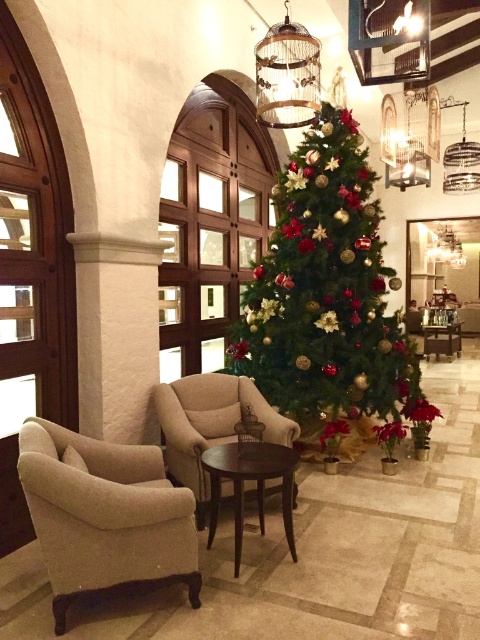
Question: Among these objects, which one is farthest from the camera?

Choices:
 (A) beige fabric armchair at left
 (B) shiny gold christmas tree at center
 (C) beige fabric armchair at center

Answer: (B)

Question: Which point is closer to the camera?

Choices:
 (A) shiny gold christmas tree at center
 (B) beige fabric armchair at center
 (C) beige fabric armchair at left

Answer: (C)

Question: Can you confirm if shiny gold christmas tree at center is smaller than beige fabric armchair at center?

Choices:
 (A) no
 (B) yes

Answer: (A)

Question: From the image, what is the correct spatial relationship of shiny gold christmas tree at center in relation to beige fabric armchair at center?

Choices:
 (A) left
 (B) right

Answer: (B)

Question: Does shiny gold christmas tree at center appear on the left side of beige fabric armchair at center?

Choices:
 (A) no
 (B) yes

Answer: (A)

Question: Estimate the real-world distances between objects in this image. Which object is closer to the beige fabric armchair at center?

Choices:
 (A) shiny gold christmas tree at center
 (B) beige fabric armchair at left

Answer: (B)